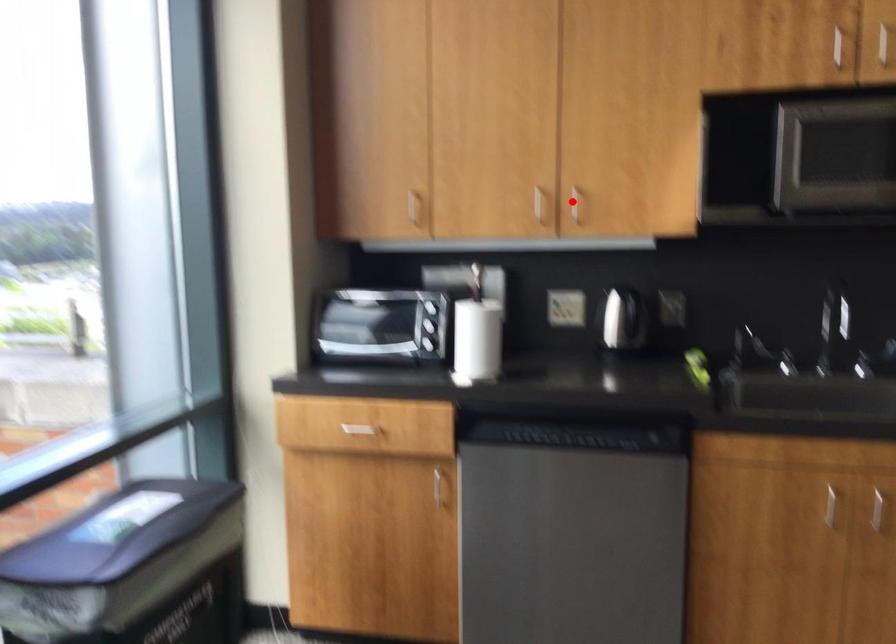
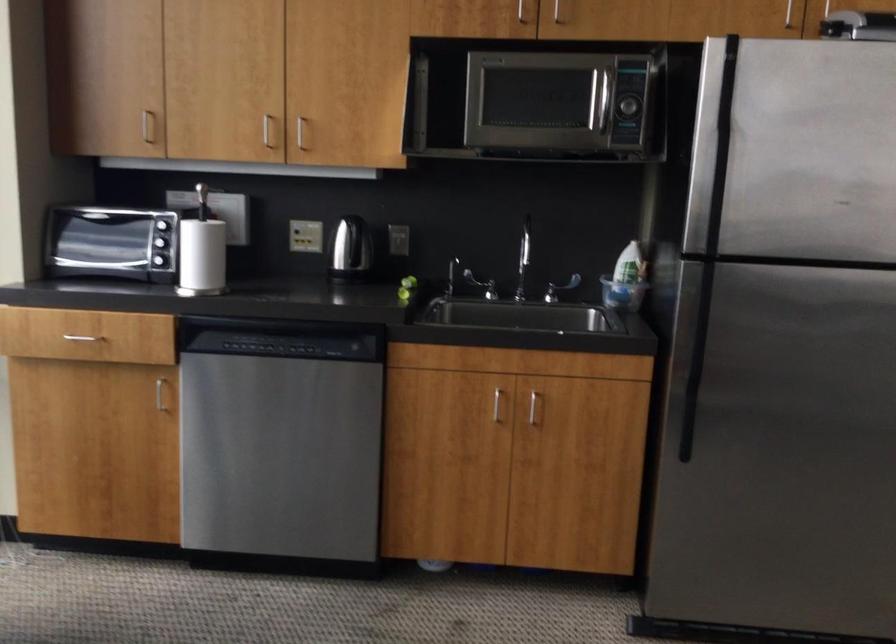
Locate, in the second image, the point that corresponds to the highlighted location in the first image.

(300, 131)